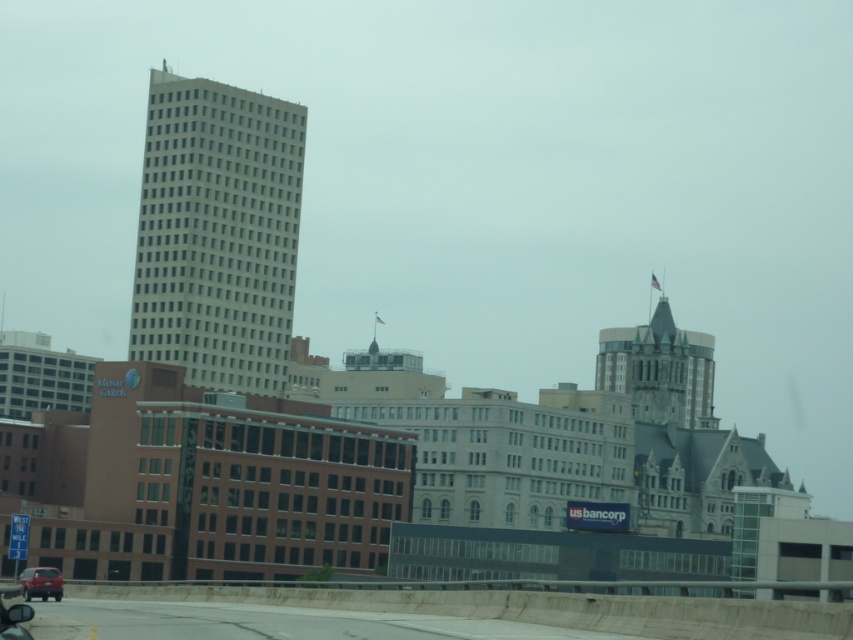
Based on the photo, which of these two, white smooth building at center or green copper spire at upper right, stands taller?

With more height is white smooth building at center.

Locate an element on the screen. white smooth building at center is located at coordinates 218,232.

Where is `white smooth building at center`? The image size is (853, 640). white smooth building at center is located at coordinates (218, 232).

Which is behind, point (219, 193) or point (55, 579)?

The point (219, 193) is behind.

Can you confirm if white smooth building at center is positioned below matte red car at lower left?

No.

Which is in front, point (175, 336) or point (24, 573)?

Point (24, 573) is more forward.

Identify the location of white smooth building at center. pos(218,232).

Does green copper spire at upper right have a greater height compared to matte red car at lower left?

Correct, green copper spire at upper right is much taller as matte red car at lower left.

Who is taller, green copper spire at upper right or matte red car at lower left?

With more height is green copper spire at upper right.

Is point (700, 381) behind point (38, 589)?

Yes, point (700, 381) is farther from viewer.

This screenshot has width=853, height=640. In order to click on green copper spire at upper right in this screenshot , I will do `click(659, 369)`.